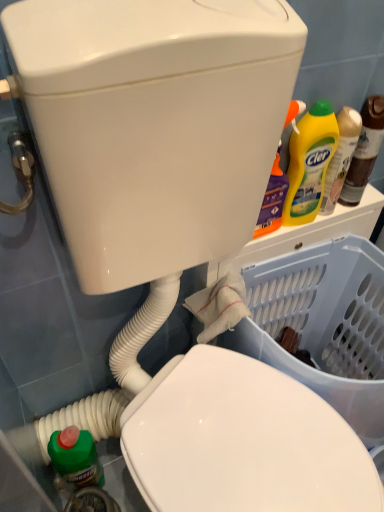
Question: From a real-world perspective, is yellow matte bottle at upper right below yellow plastic bottle at upper right, the 2th bottle from the right?

Choices:
 (A) no
 (B) yes

Answer: (A)

Question: Can you confirm if yellow matte bottle at upper right is bigger than yellow plastic bottle at upper right, the 1th bottle when ordered from left to right?

Choices:
 (A) yes
 (B) no

Answer: (A)

Question: Considering the relative positions of yellow matte bottle at upper right and yellow plastic bottle at upper right, the 2th bottle from the right, in the image provided, is yellow matte bottle at upper right in front of yellow plastic bottle at upper right, the 2th bottle from the right,?

Choices:
 (A) no
 (B) yes

Answer: (B)

Question: Is yellow plastic bottle at upper right, the 1th bottle when ordered from left to right, completely or partially inside yellow matte bottle at upper right?

Choices:
 (A) no
 (B) yes

Answer: (A)

Question: Is yellow matte bottle at upper right facing towards yellow plastic bottle at upper right, the 1th bottle when ordered from left to right?

Choices:
 (A) no
 (B) yes

Answer: (A)

Question: Is yellow matte bottle at upper right inside the boundaries of yellow plastic bottle at upper right, the 1th bottle when ordered from left to right, or outside?

Choices:
 (A) outside
 (B) inside

Answer: (A)

Question: In terms of height, does yellow matte bottle at upper right look taller or shorter compared to yellow plastic bottle at upper right, the 2th bottle from the right?

Choices:
 (A) tall
 (B) short

Answer: (A)

Question: From the image's perspective, is yellow matte bottle at upper right positioned above or below yellow plastic bottle at upper right, the 2th bottle from the right?

Choices:
 (A) below
 (B) above

Answer: (A)

Question: From a real-world perspective, is yellow matte bottle at upper right physically located above or below yellow plastic bottle at upper right, the 1th bottle when ordered from left to right?

Choices:
 (A) below
 (B) above

Answer: (B)

Question: In terms of height, does transparent plastic basket at lower right look taller or shorter compared to yellow liquid detergent at upper right, which is the 1th bottle from right to left?

Choices:
 (A) tall
 (B) short

Answer: (A)

Question: Considering the positions of transparent plastic basket at lower right and yellow liquid detergent at upper right, which is the 1th bottle from right to left, in the image, is transparent plastic basket at lower right bigger or smaller than yellow liquid detergent at upper right, which is the 1th bottle from right to left,?

Choices:
 (A) small
 (B) big

Answer: (B)

Question: Is transparent plastic basket at lower right inside or outside of yellow liquid detergent at upper right, which is the second bottle from left to right?

Choices:
 (A) outside
 (B) inside

Answer: (A)

Question: From a real-world perspective, is transparent plastic basket at lower right positioned above or below yellow liquid detergent at upper right, which is the 1th bottle from right to left?

Choices:
 (A) below
 (B) above

Answer: (A)

Question: In terms of size, does yellow liquid detergent at upper right, which is the second bottle from left to right, appear bigger or smaller than yellow plastic bottle at upper right, the 1th bottle when ordered from left to right?

Choices:
 (A) big
 (B) small

Answer: (A)

Question: Is yellow liquid detergent at upper right, which is the 1th bottle from right to left, in front of or behind yellow plastic bottle at upper right, the 2th bottle from the right, in the image?

Choices:
 (A) front
 (B) behind

Answer: (A)